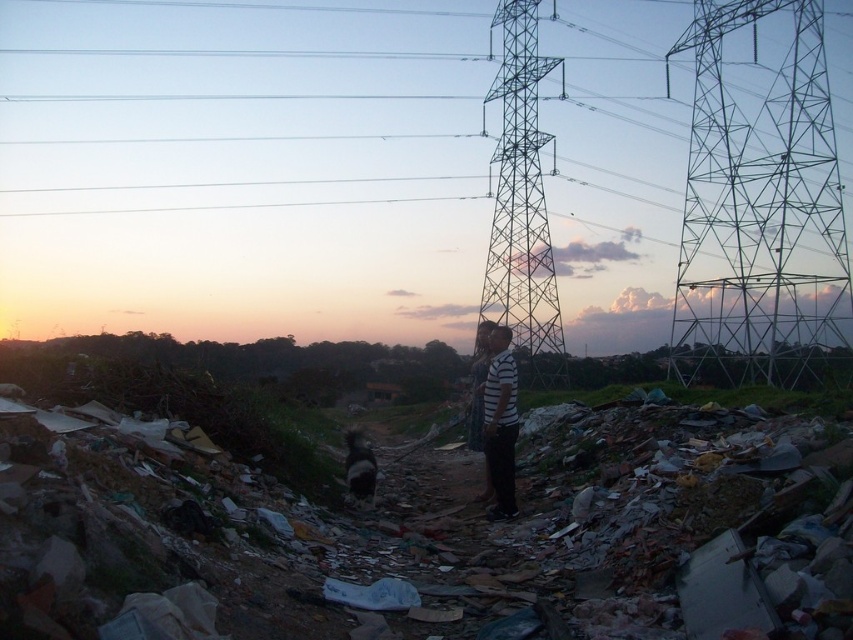
Question: Which of the following is the farthest from the observer?

Choices:
 (A) (840, 323)
 (B) (556, 301)
 (C) (495, 385)

Answer: (B)

Question: Which point is farther to the camera?

Choices:
 (A) (537, 326)
 (B) (492, 512)

Answer: (A)

Question: Does metallic grid structure at upper right come behind white striped shirt at center?

Choices:
 (A) yes
 (B) no

Answer: (A)

Question: Which point is farther to the camera?

Choices:
 (A) metallic structure at center
 (B) metallic grid structure at upper right

Answer: (A)

Question: Can you confirm if metallic grid structure at upper right is thinner than white striped shirt at center?

Choices:
 (A) no
 (B) yes

Answer: (A)

Question: Does metallic structure at center appear over white striped shirt at center?

Choices:
 (A) no
 (B) yes

Answer: (B)